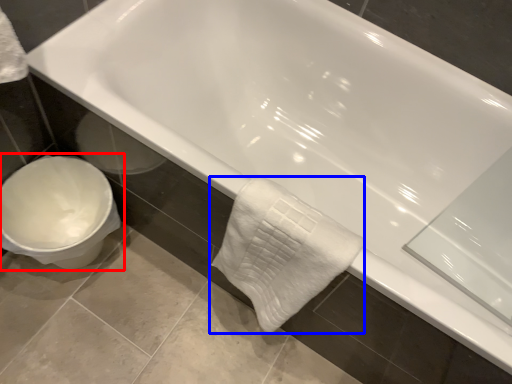
Question: Which of the following is the closest to the observer, toilet (highlighted by a red box) or bath towel (highlighted by a blue box)?

Choices:
 (A) toilet
 (B) bath towel

Answer: (B)